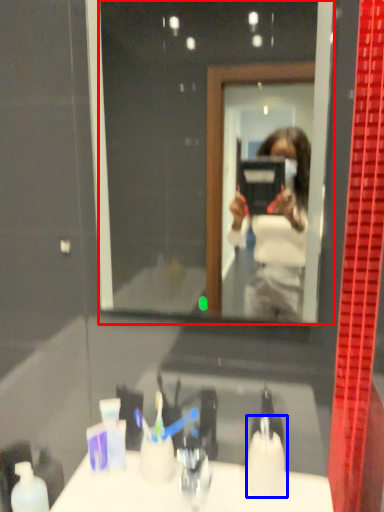
Question: Which point is further to the camera, mirror (highlighted by a red box) or toiletry (highlighted by a blue box)?

Choices:
 (A) mirror
 (B) toiletry

Answer: (B)